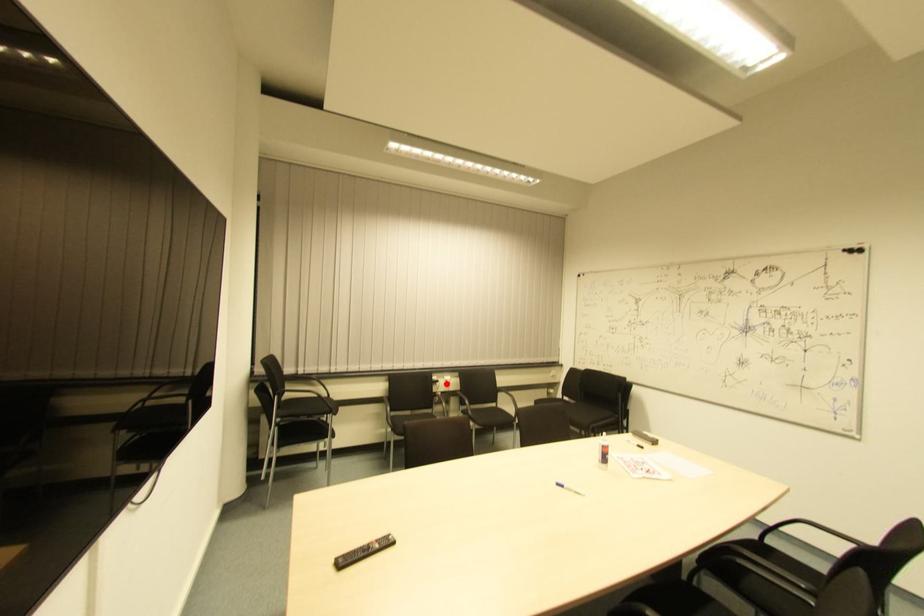
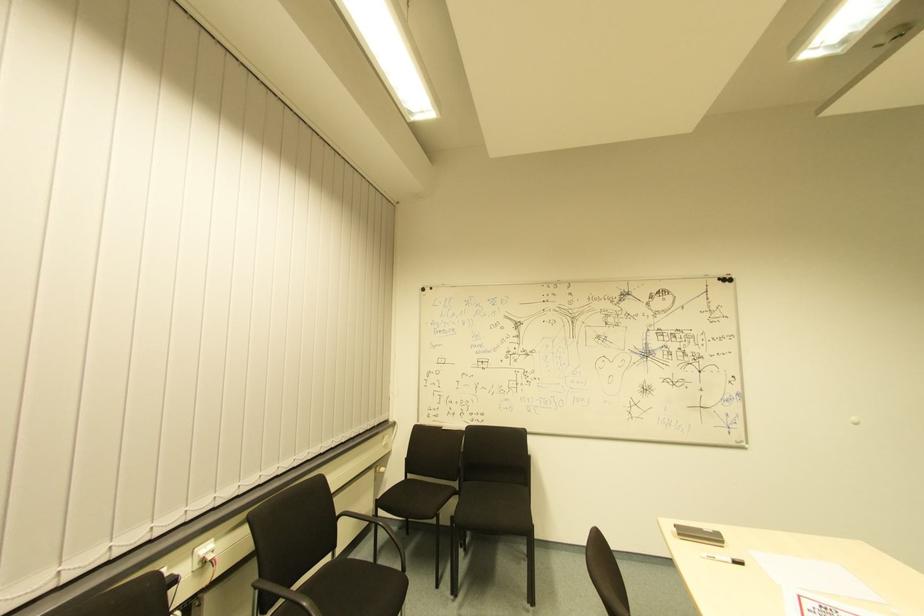
Question: I am providing you with two images of the same scene from different viewpoints. Image1 has a red point marked. In image2, the corresponding 3D location appears at what relative position? Reply with the corresponding letter.

Choices:
 (A) Closer
 (B) Farther

Answer: (A)